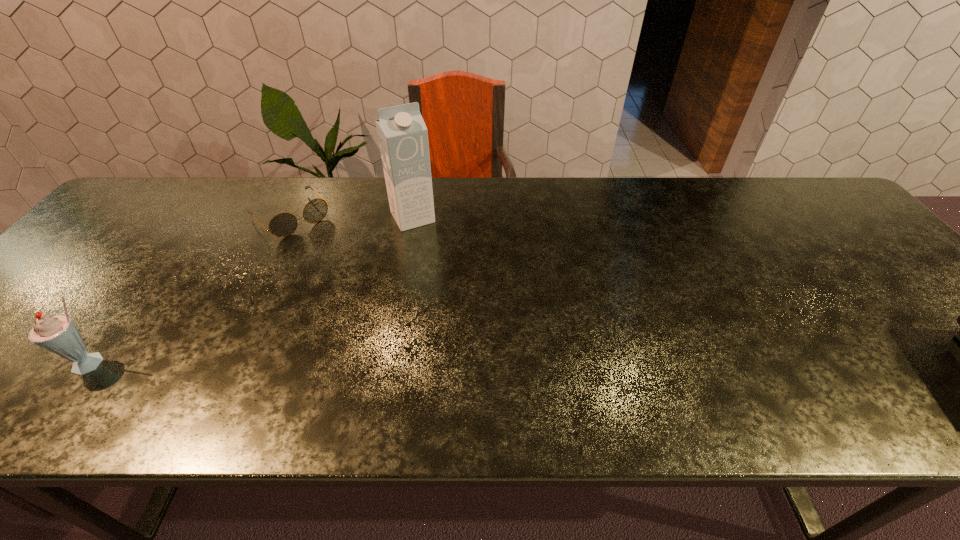
The width and height of the screenshot is (960, 540). Identify the location of vacant space at the far right corner of the desktop. [807, 183].

You are a GUI agent. You are given a task and a screenshot of the screen. Output one action in this format:
    pyautogui.click(x=<x>, y=<y>)
    Task: Click on the vacant area that lies between the second shortest object and the sunglasses
    This screenshot has width=960, height=540.
    Given the screenshot: What is the action you would take?
    pyautogui.click(x=192, y=290)

The height and width of the screenshot is (540, 960). I want to click on free space between the carton and the shortest object, so click(x=351, y=217).

You are a GUI agent. You are given a task and a screenshot of the screen. Output one action in this format:
    pyautogui.click(x=<x>, y=<y>)
    Task: Click on the vacant area that lies between the leftmost object and the shortest object
    The image size is (960, 540).
    Given the screenshot: What is the action you would take?
    pyautogui.click(x=192, y=290)

Find the location of a particular element. The width and height of the screenshot is (960, 540). free spot between the carton and the second shortest object is located at coordinates 252,291.

Find the location of `unoccupied area between the third tallest object and the tallest object`. unoccupied area between the third tallest object and the tallest object is located at coordinates (252, 291).

Identify the location of vacant space that is in between the milkshake and the sunglasses. The image size is (960, 540). (192, 290).

This screenshot has height=540, width=960. Find the location of `object identified as the closest to the milkshake`. object identified as the closest to the milkshake is located at coordinates (284, 224).

In order to click on object that is the second nearest to the shortest object in this screenshot , I will do `click(58, 334)`.